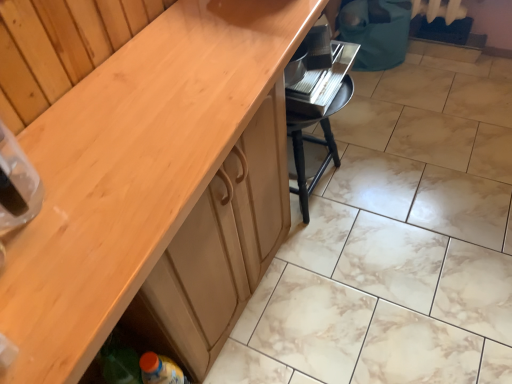
Identify the location of free space above wooden cabinet at center (from a real-world perspective). The width and height of the screenshot is (512, 384). (178, 94).